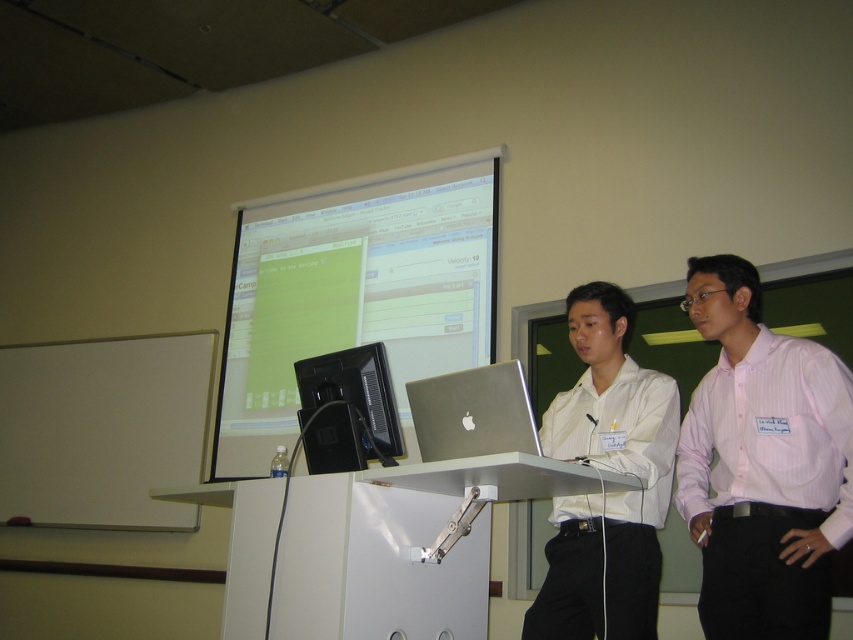
Question: Estimate the real-world distances between objects in this image. Which object is farther from the black glossy monitor at center?

Choices:
 (A) matte white projection screen at upper center
 (B) pink striped shirt at center right
 (C) white glossy shirt at center

Answer: (A)

Question: Is pink striped shirt at center right positioned behind black glossy monitor at center?

Choices:
 (A) no
 (B) yes

Answer: (A)

Question: Which point is closer to the camera?

Choices:
 (A) matte white projection screen at upper center
 (B) black glossy monitor at center

Answer: (B)

Question: Which point is closer to the camera taking this photo?

Choices:
 (A) (299, 212)
 (B) (374, 355)
 (C) (614, 515)
 (D) (701, 572)

Answer: (C)

Question: Does pink striped shirt at center right have a greater width compared to white glossy shirt at center?

Choices:
 (A) yes
 (B) no

Answer: (B)

Question: Does pink striped shirt at center right appear under white glossy shirt at center?

Choices:
 (A) yes
 (B) no

Answer: (B)